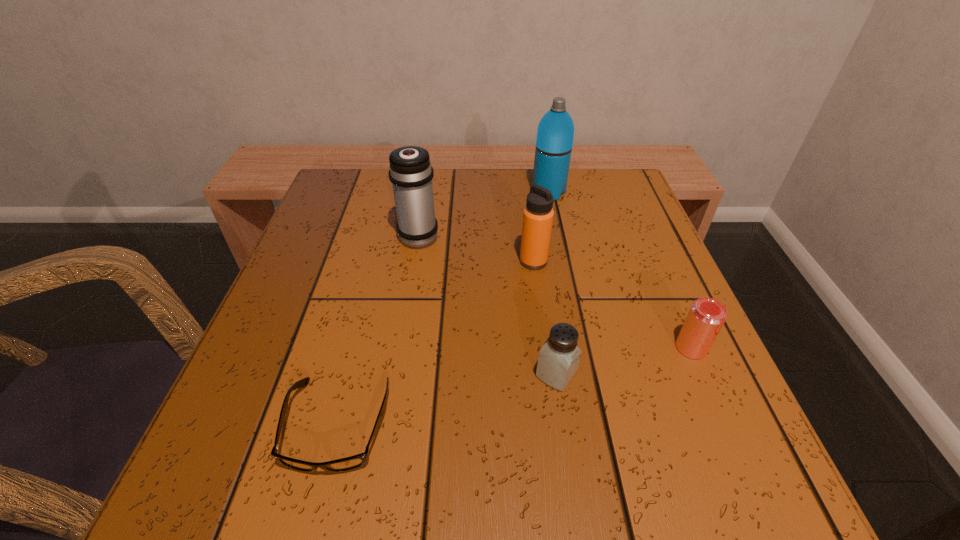
Locate an element on the screen. The width and height of the screenshot is (960, 540). free area in between the third tallest object and the leftmost thermos bottle is located at coordinates (476, 248).

Where is `free space between the farthest object and the beer can`? This screenshot has width=960, height=540. free space between the farthest object and the beer can is located at coordinates (x=620, y=270).

You are a GUI agent. You are given a task and a screenshot of the screen. Output one action in this format:
    pyautogui.click(x=<x>, y=<y>)
    Task: Click on the free spot between the saltshaker and the farthest thermos bottle
    This screenshot has width=960, height=540.
    Given the screenshot: What is the action you would take?
    pyautogui.click(x=553, y=284)

Find the location of a particular element. vacant region between the saltshaker and the spectacles is located at coordinates (447, 399).

Locate an element on the screen. blank region between the spectacles and the saltshaker is located at coordinates (447, 399).

Locate an element on the screen. empty space that is in between the saltshaker and the shortest thermos bottle is located at coordinates (545, 318).

Identify the location of free space between the shortest object and the rightmost object. (515, 386).

Identify the location of object that is the second closest to the rightmost object. (538, 215).

Point out which object is positioned as the third nearest to the leftmost thermos bottle. Please provide its 2D coordinates. Your answer should be formatted as a tuple, i.e. [(x, y)], where the tuple contains the x and y coordinates of a point satisfying the conditions above.

[(349, 463)]

Identify which thermos bottle is the nearest to the beer can. Please provide its 2D coordinates. Your answer should be formatted as a tuple, i.e. [(x, y)], where the tuple contains the x and y coordinates of a point satisfying the conditions above.

[(538, 215)]